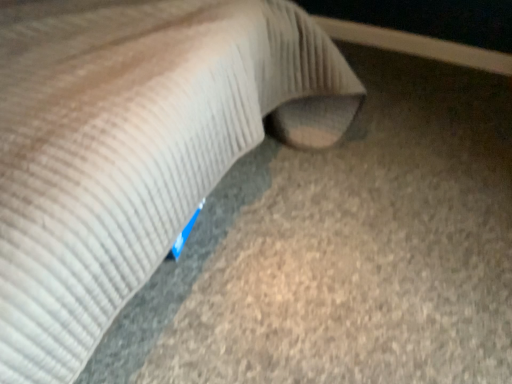
Find the location of a particular element. Image resolution: width=512 pixels, height=384 pixels. vacant space to the right of beige corduroy pillow at center is located at coordinates (403, 257).